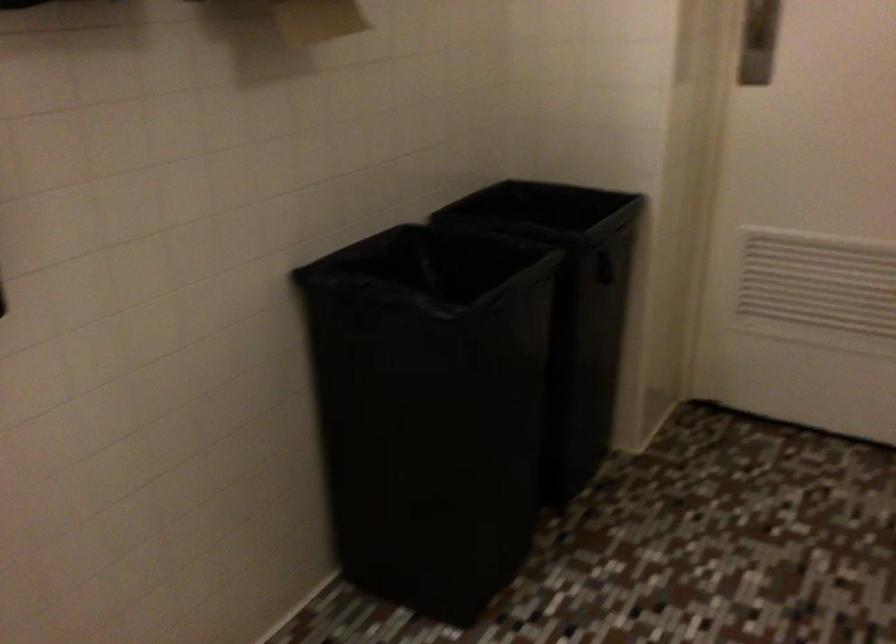
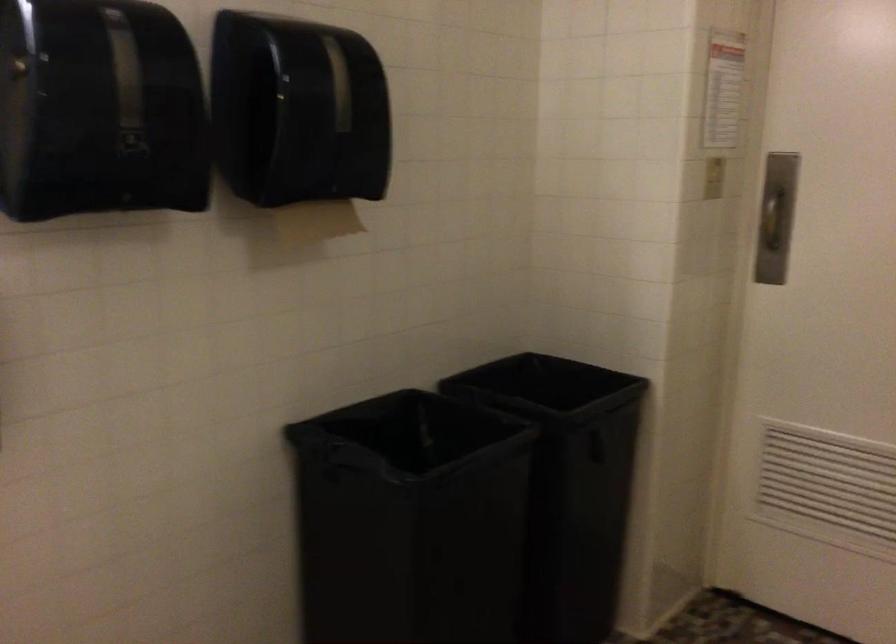
Find the pixel in the second image that matches the point at 455,351 in the first image.

(410, 518)